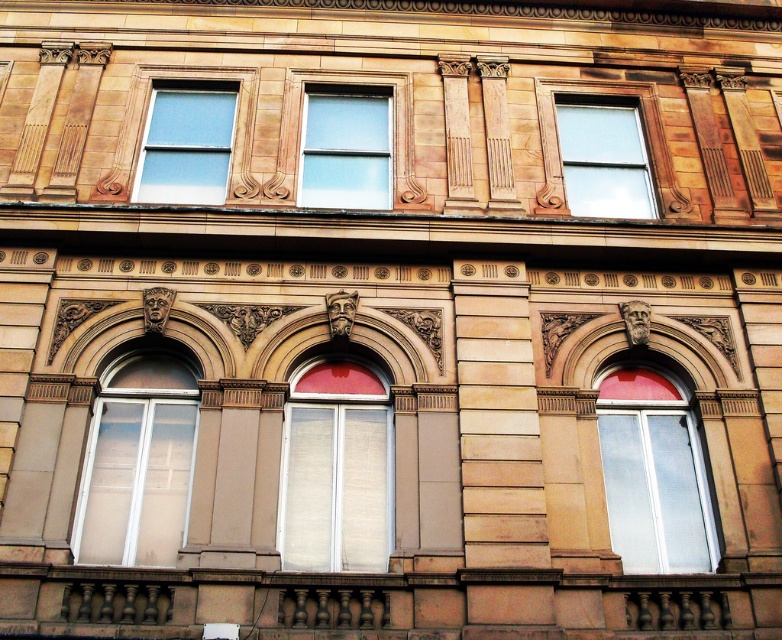
Is white matte window at center to the right of white glass window at center from the viewer's perspective?

Indeed, white matte window at center is positioned on the right side of white glass window at center.

Is white matte window at center positioned before white glass window at center?

No, white matte window at center is further to the viewer.

Locate an element on the screen. This screenshot has width=782, height=640. white matte window at center is located at coordinates (336, 470).

Is white glass window at center smaller than matte glass window at upper center?

No.

In order to click on white glass window at center in this screenshot , I will do `click(138, 464)`.

Between point (117, 394) and point (653, 216), which one is positioned in front?

Positioned in front is point (117, 394).

Where is `white glass window at center`? Image resolution: width=782 pixels, height=640 pixels. white glass window at center is located at coordinates pyautogui.click(x=138, y=464).

Which is more to the right, clear glass window at center right or matte glass window at upper left?

Positioned to the right is clear glass window at center right.

Is clear glass window at center right below matte glass window at upper left?

Yes, clear glass window at center right is below matte glass window at upper left.

Is point (650, 552) positioned before point (178, 189)?

Yes, it is in front of point (178, 189).

Identify the location of clear glass window at center right. (651, 476).